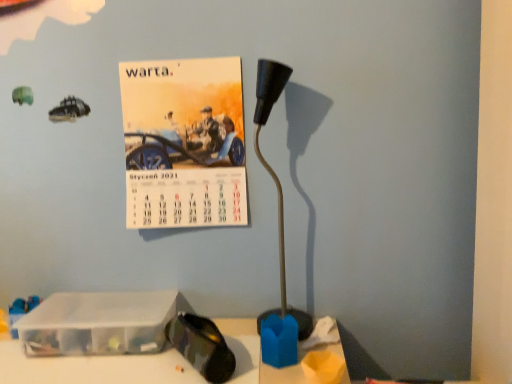
Question: Is transparent plastic container at lower left oriented towards matte paper calendar at upper left?

Choices:
 (A) no
 (B) yes

Answer: (A)

Question: From a real-world perspective, is transparent plastic container at lower left on matte paper calendar at upper left?

Choices:
 (A) no
 (B) yes

Answer: (A)

Question: Is transparent plastic container at lower left turned away from matte paper calendar at upper left?

Choices:
 (A) yes
 (B) no

Answer: (B)

Question: From a real-world perspective, is transparent plastic container at lower left beneath matte paper calendar at upper left?

Choices:
 (A) no
 (B) yes

Answer: (B)

Question: Does transparent plastic container at lower left have a lesser width compared to matte paper calendar at upper left?

Choices:
 (A) no
 (B) yes

Answer: (A)

Question: Considering the positions of transparent plastic container at lower left and matte paper calendar at upper left in the image, is transparent plastic container at lower left bigger or smaller than matte paper calendar at upper left?

Choices:
 (A) small
 (B) big

Answer: (A)

Question: Considering the positions of point (58, 314) and point (167, 144), is point (58, 314) closer or farther from the camera than point (167, 144)?

Choices:
 (A) farther
 (B) closer

Answer: (B)

Question: Considering the positions of transparent plastic container at lower left and matte paper calendar at upper left in the image, is transparent plastic container at lower left taller or shorter than matte paper calendar at upper left?

Choices:
 (A) short
 (B) tall

Answer: (A)

Question: From a real-world perspective, relative to matte paper calendar at upper left, is transparent plastic container at lower left vertically above or below?

Choices:
 (A) below
 (B) above

Answer: (A)

Question: Would you say matte paper calendar at upper left is inside or outside black plastic lamp at center?

Choices:
 (A) inside
 (B) outside

Answer: (B)

Question: From the image's perspective, relative to black plastic lamp at center, is matte paper calendar at upper left above or below?

Choices:
 (A) below
 (B) above

Answer: (B)

Question: In the image, is matte paper calendar at upper left on the left side or the right side of black plastic lamp at center?

Choices:
 (A) left
 (B) right

Answer: (A)

Question: In terms of size, does matte paper calendar at upper left appear bigger or smaller than black plastic lamp at center?

Choices:
 (A) big
 (B) small

Answer: (A)

Question: In terms of height, does transparent plastic container at lower left look taller or shorter compared to black plastic lamp at center?

Choices:
 (A) tall
 (B) short

Answer: (B)

Question: Is transparent plastic container at lower left to the left or to the right of black plastic lamp at center in the image?

Choices:
 (A) right
 (B) left

Answer: (B)